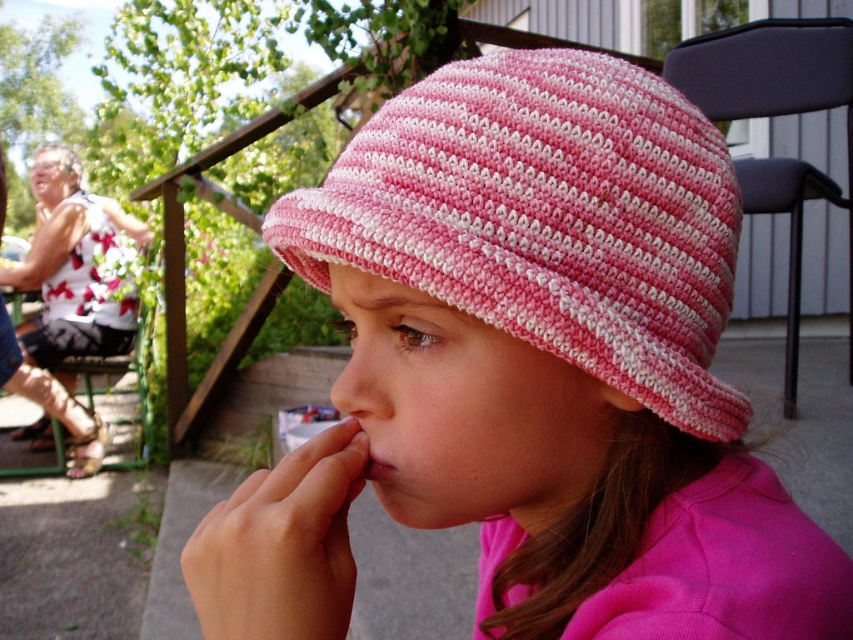
Question: Which object is closer to the camera taking this photo?

Choices:
 (A) pink striped knit hat at center
 (B) pink knitted hat at center

Answer: (B)

Question: Is pink knitted hat at center above pink knitted nose at center?

Choices:
 (A) no
 (B) yes

Answer: (A)

Question: Is pink knitted hat at center thinner than pink striped knit hat at center?

Choices:
 (A) yes
 (B) no

Answer: (B)

Question: Which of the following is the closest to the observer?

Choices:
 (A) (543, 404)
 (B) (378, 404)
 (C) (590, 152)

Answer: (C)

Question: Which object is farther from the camera taking this photo?

Choices:
 (A) pink knitted hat at center
 (B) pink striped knit hat at center

Answer: (B)

Question: Is pink knitted hat at center below pink striped knit hat at center?

Choices:
 (A) yes
 (B) no

Answer: (A)